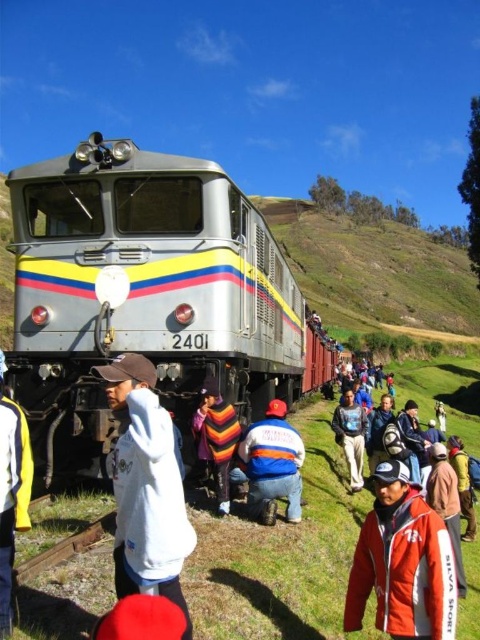
You are a photographer at the railway station. You want to take a photo of the silver metallic train at center and the orange and blue jacket at center. Which object should you focus on first to ensure both are in the frame?

The silver metallic train at center is positioned over orange and blue jacket at center, so you should focus on the silver metallic train at center first to ensure both are in the frame.

You are a photographer trying to capture the entire group of people at the railway station. You notice the white fleece jacket at lower left and the multicolored woven shawl at center. Which item takes up more space in the photo?

The multicolored woven shawl at center occupies more space than the white fleece jacket at lower left.